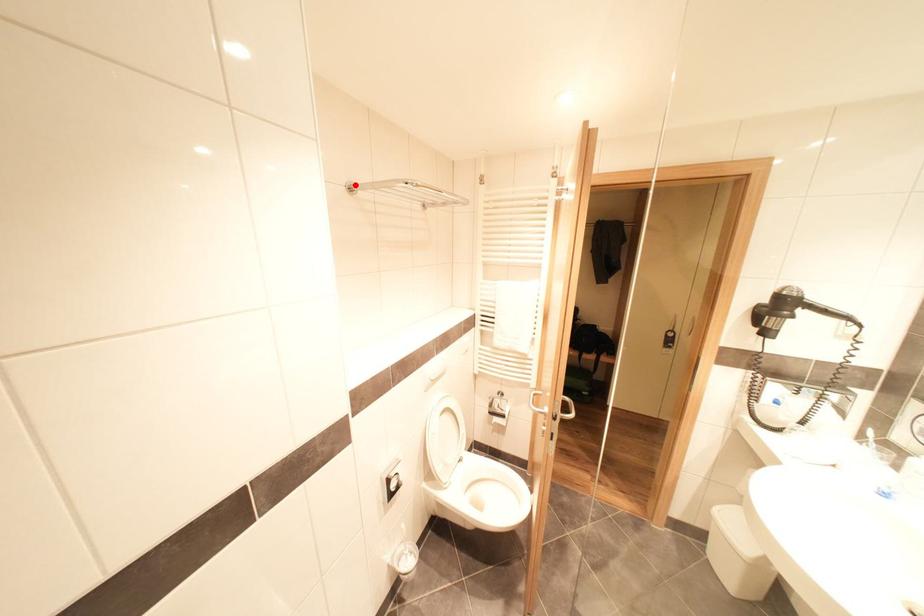
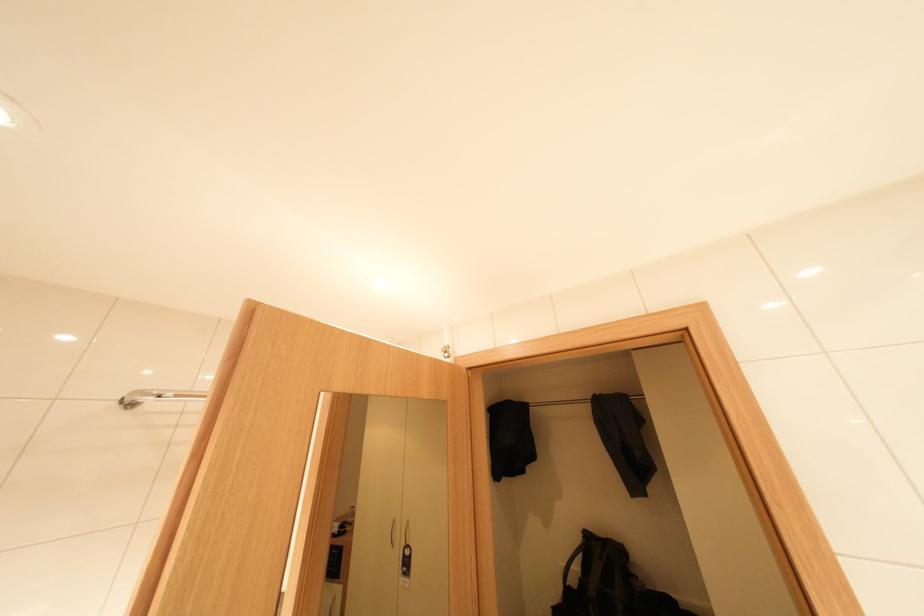
The point at the highlighted location is marked in the first image. Where is the corresponding point in the second image?

(130, 399)